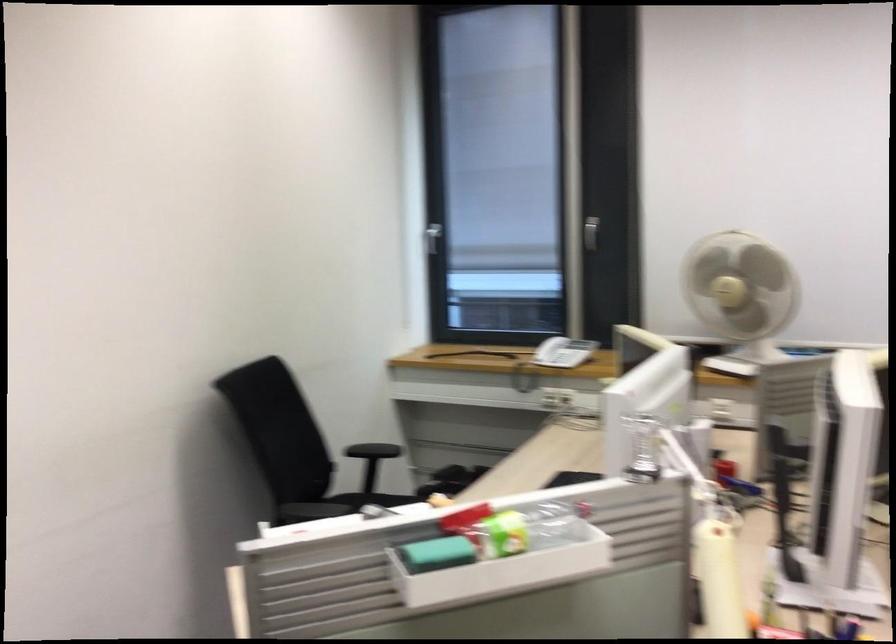
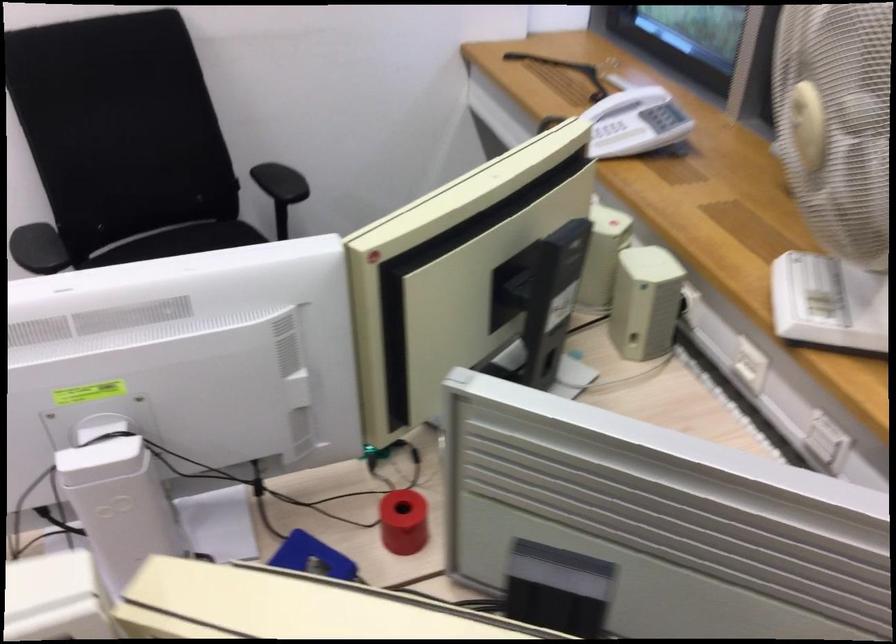
Question: I am providing you with two images of the same scene from different viewpoints. After the viewpoint changes to image2, which objects are now occluded?

Choices:
 (A) chair sitting surface
 (B) white desk fan
 (C) shallow cardboard box
 (D) fan control buttons

Answer: (B)